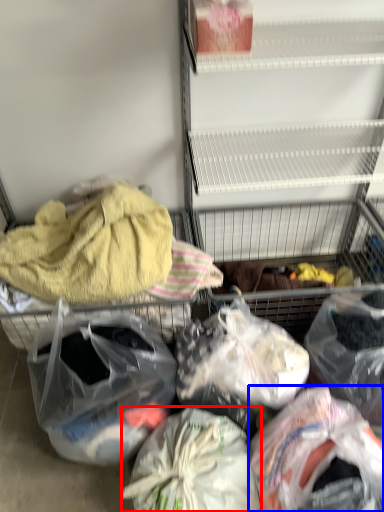
Question: Which object appears farthest to the camera in this image, plastic bag (highlighted by a red box) or plastic bag (highlighted by a blue box)?

Choices:
 (A) plastic bag
 (B) plastic bag

Answer: (A)